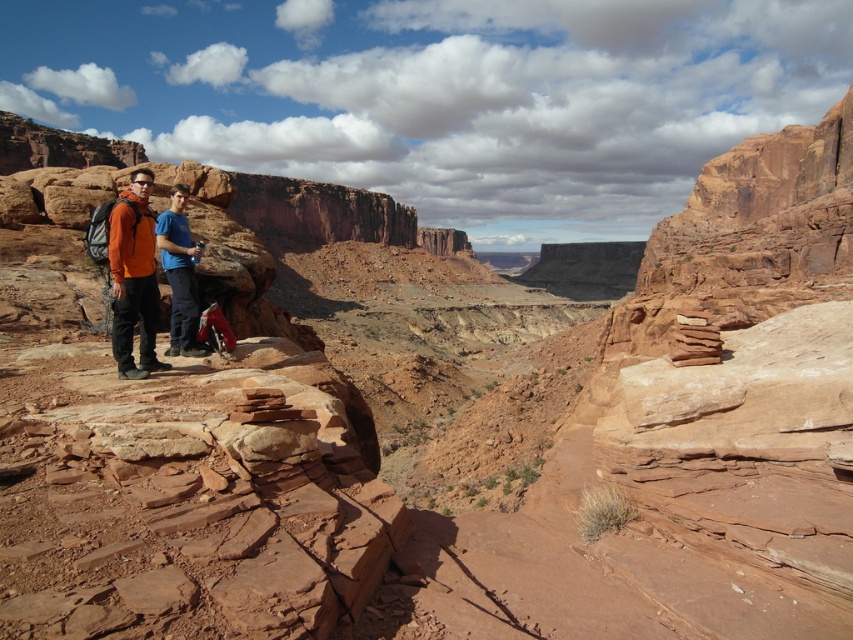
Question: Does matte orange jacket at left have a larger size compared to blue cotton shirt at center?

Choices:
 (A) yes
 (B) no

Answer: (A)

Question: Is matte orange jacket at left behind blue cotton shirt at center?

Choices:
 (A) no
 (B) yes

Answer: (A)

Question: Considering the relative positions of matte orange jacket at left and blue cotton shirt at center in the image provided, where is matte orange jacket at left located with respect to blue cotton shirt at center?

Choices:
 (A) left
 (B) right

Answer: (A)

Question: Which point is farther from the camera taking this photo?

Choices:
 (A) (132, 244)
 (B) (181, 307)

Answer: (B)

Question: Which point appears closest to the camera in this image?

Choices:
 (A) [140, 324]
 (B) [187, 301]

Answer: (A)